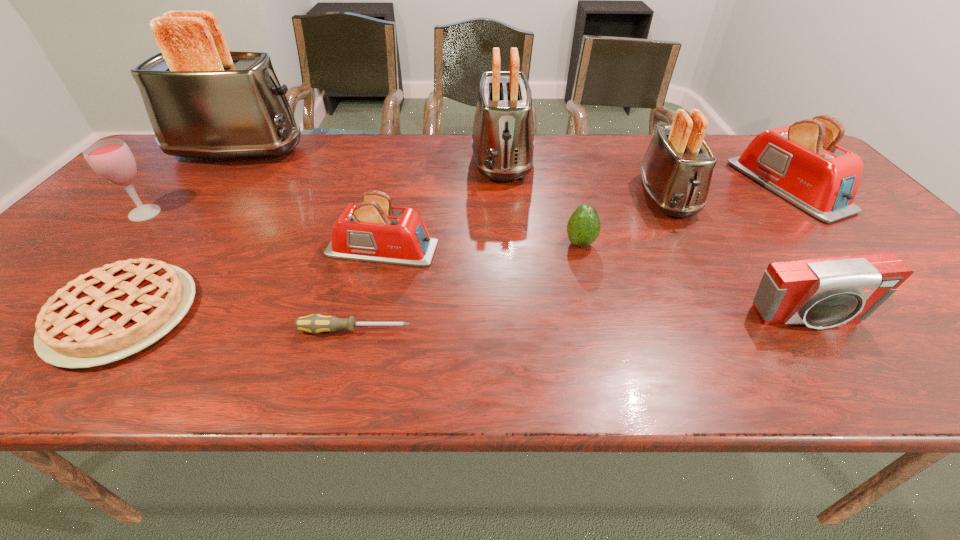
Identify the location of vacant area that lies between the wineglass and the second toaster from right to left. The width and height of the screenshot is (960, 540). (406, 205).

Identify the location of free space between the camera and the farther red toaster. This screenshot has height=540, width=960. (798, 253).

Where is `free space that is in between the pie and the biggest gray toaster`? free space that is in between the pie and the biggest gray toaster is located at coordinates (180, 233).

What are the coordinates of `free space between the nearest toaster and the tallest object` in the screenshot? It's located at (310, 200).

Image resolution: width=960 pixels, height=540 pixels. I want to click on vacant area that lies between the pie and the gray screwdriver, so click(239, 322).

Identify the location of free area in between the fourth toaster from left to right and the gray screwdriver. The width and height of the screenshot is (960, 540). (511, 264).

Where is `vacant area that lies between the camera and the second tallest toaster`? Image resolution: width=960 pixels, height=540 pixels. vacant area that lies between the camera and the second tallest toaster is located at coordinates (655, 240).

I want to click on free space between the rightmost gray toaster and the camera, so click(737, 258).

The height and width of the screenshot is (540, 960). In order to click on vacant area that lies between the camera and the shortest object in this screenshot , I will do `click(581, 325)`.

This screenshot has height=540, width=960. I want to click on object that is the closest one to the rightmost toaster, so click(677, 168).